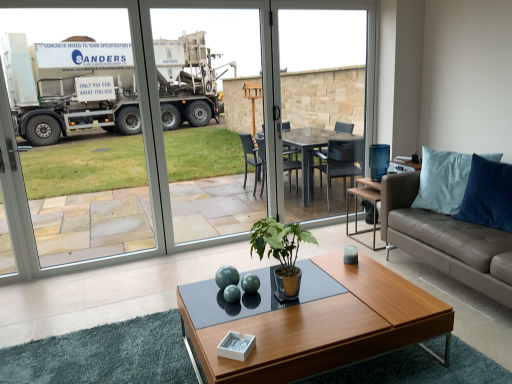
Image resolution: width=512 pixels, height=384 pixels. What do you see at coordinates (446, 239) in the screenshot?
I see `leather couch at right` at bounding box center [446, 239].

At what (x,y) coordinates should I click in order to perform the action: click on transparent glass table at center. Please return your answer as a coordinate pair (x, y). Looking at the image, I should click on (322, 102).

The image size is (512, 384). What do you see at coordinates (21, 170) in the screenshot? I see `transparent glass screen door at center` at bounding box center [21, 170].

From the picture: In order to face wooden coffee table at center, should I rotate leftwards or rightwards?

Turn right by 6.436 degrees to look at wooden coffee table at center.

Image resolution: width=512 pixels, height=384 pixels. Describe the element at coordinates (442, 181) in the screenshot. I see `blue suede pillow at right` at that location.

The image size is (512, 384). Find the location of `leather couch at right`. leather couch at right is located at coordinates (446, 239).

From a real-world perspective, does leather couch at right sit lower than green glossy plant at center?

Yes, from a real-world perspective, leather couch at right is below green glossy plant at center.

The height and width of the screenshot is (384, 512). What are the coordinates of `studio couch behind the green glossy plant at center` in the screenshot? It's located at (446, 239).

Consider the image. Is leather couch at right further to camera compared to green glossy plant at center?

Yes, the depth of leather couch at right is greater than that of green glossy plant at center.

From a real-world perspective, who is located higher, wooden coffee table at center or leather couch at right?

leather couch at right.

Who is shorter, wooden coffee table at center or leather couch at right?

With less height is wooden coffee table at center.

Visually, is wooden coffee table at center positioned to the left or to the right of leather couch at right?

In the image, wooden coffee table at center appears on the left side of leather couch at right.

Is green glossy plant at center at the back of transparent glass table at center?

transparent glass table at center does not have its back to green glossy plant at center.

Between transparent glass table at center and green glossy plant at center, which one has larger width?

With larger width is green glossy plant at center.

Is transparent glass table at center shorter than green glossy plant at center?

No, transparent glass table at center is not shorter than green glossy plant at center.

Does point (426, 148) lie behind point (340, 65)?

No, it is not.

Find the location of a particular element. The image size is (512, 384). window screen that is on the left side of blue suede pillow at right is located at coordinates (322, 102).

From a real-world perspective, is blue suede pillow at right physically located above or below transparent glass table at center?

Clearly, from a real-world perspective, blue suede pillow at right is below transparent glass table at center.

What's the angular difference between blue suede pillow at right and transparent glass table at center's facing directions?

The angle between the facing direction of blue suede pillow at right and the facing direction of transparent glass table at center is 55.4 degrees.

Is green glossy plant at center taller or shorter than blue suede pillow at right?

Clearly, green glossy plant at center is shorter compared to blue suede pillow at right.

Is green glossy plant at center located outside blue suede pillow at right?

Absolutely, green glossy plant at center is external to blue suede pillow at right.

Which is farther from the camera, (258, 231) or (449, 160)?

The point (449, 160) is more distant.

Based on their sizes in the image, would you say green glossy plant at center is bigger or smaller than blue suede pillow at right?

green glossy plant at center is smaller than blue suede pillow at right.

Which of these two, transparent glass table at center or leather couch at right, is thinner?

transparent glass table at center.

Which of these two, transparent glass table at center or leather couch at right, is bigger?

Bigger between the two is leather couch at right.

Is transparent glass table at center behind leather couch at right?

Yes, the depth of transparent glass table at center is greater than that of leather couch at right.

Would you say transparent glass table at center is a long distance from wooden coffee table at center?

That's right, there is a large distance between transparent glass table at center and wooden coffee table at center.

Identify the location of window screen above the wooden coffee table at center (from a real-world perspective). Image resolution: width=512 pixels, height=384 pixels. (322, 102).

Does transparent glass table at center turn towards wooden coffee table at center?

No, transparent glass table at center is not aimed at wooden coffee table at center.

Could wooden coffee table at center be considered to be inside transparent glass table at center?

No, wooden coffee table at center is not inside transparent glass table at center.

I want to click on houseplant above the leather couch at right (from a real-world perspective), so click(x=281, y=252).

Identify the location of studio couch behind the wooden coffee table at center. This screenshot has height=384, width=512. (446, 239).

Estimate the real-world distances between objects in this image. Which object is closer to leather couch at right, transparent glass table at center or transparent glass screen door at center?

The object closer to leather couch at right is transparent glass table at center.

When comparing their distances from green glossy plant at center, does transparent glass table at center or transparent glass screen door at center seem closer?

transparent glass screen door at center is closer to green glossy plant at center.

From the image, which object appears to be nearer to wooden coffee table at center, blue suede pillow at right or transparent glass table at center?

blue suede pillow at right lies closer to wooden coffee table at center than the other object.

Which object lies nearer to the anchor point blue suede pillow at right, green glossy plant at center or wooden coffee table at center?

wooden coffee table at center lies closer to blue suede pillow at right than the other object.

Estimate the real-world distances between objects in this image. Which object is closer to transparent glass table at center, transparent glass screen door at center or wooden coffee table at center?

The object closer to transparent glass table at center is transparent glass screen door at center.

When comparing their distances from transparent glass table at center, does blue suede pillow at right or green glossy plant at center seem closer?

blue suede pillow at right lies closer to transparent glass table at center than the other object.

From the image, which object appears to be farther from green glossy plant at center, leather couch at right or wooden coffee table at center?

leather couch at right lies further to green glossy plant at center than the other object.

Estimate the real-world distances between objects in this image. Which object is further from leather couch at right, blue suede pillow at right or green glossy plant at center?

green glossy plant at center.

Locate an element on the screen. The width and height of the screenshot is (512, 384). coffee table between transparent glass screen door at center and leather couch at right from left to right is located at coordinates (313, 322).

You are a GUI agent. You are given a task and a screenshot of the screen. Output one action in this format:
    pyautogui.click(x=<x>, y=<y>)
    Task: Click on the houseplant between transparent glass screen door at center and blue suede pillow at right in the horizontal direction
    This screenshot has height=384, width=512.
    Given the screenshot: What is the action you would take?
    pyautogui.click(x=281, y=252)

The width and height of the screenshot is (512, 384). Identify the location of coffee table between green glossy plant at center and blue suede pillow at right. (313, 322).

This screenshot has height=384, width=512. I want to click on houseplant between transparent glass screen door at center and transparent glass table at center in the horizontal direction, so click(281, 252).